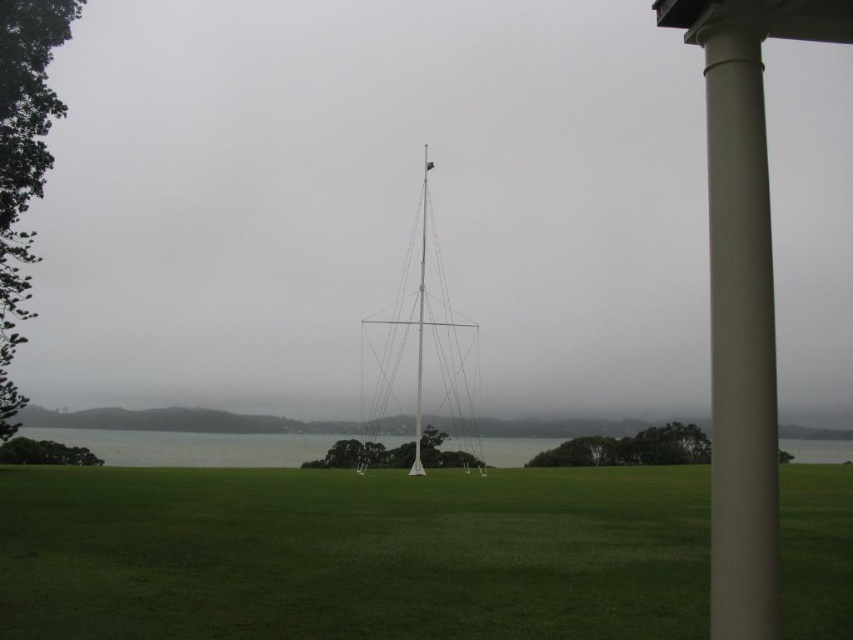
Who is more distant from viewer, (105, 532) or (437, 339)?

Positioned behind is point (437, 339).

Does point (102, 532) come behind point (375, 349)?

No, it is in front of (375, 349).

Where is `green grass at center`? The height and width of the screenshot is (640, 853). green grass at center is located at coordinates (352, 554).

Does satin beige column at right appear on the left side of white metallic flag pole at center?

Incorrect, satin beige column at right is not on the left side of white metallic flag pole at center.

Based on the photo, does satin beige column at right have a larger size compared to white metallic flag pole at center?

Correct, satin beige column at right is larger in size than white metallic flag pole at center.

The width and height of the screenshot is (853, 640). I want to click on satin beige column at right, so click(x=740, y=340).

Is green grass at center above white metallic flag pole at center?

Actually, green grass at center is below white metallic flag pole at center.

Between green grass at center and white metallic flag pole at center, which one is positioned higher?

white metallic flag pole at center is higher up.

Is point (254, 472) closer to viewer compared to point (421, 324)?

No, it is behind (421, 324).

Locate an element on the screen. The width and height of the screenshot is (853, 640). green grass at center is located at coordinates (352, 554).